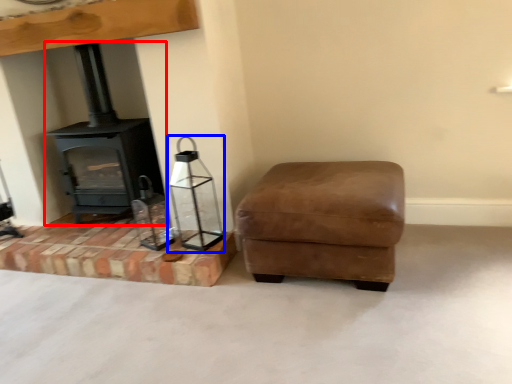
Question: Among these objects, which one is nearest to the camera, wood burning stove (highlighted by a red box) or candle holder (highlighted by a blue box)?

Choices:
 (A) wood burning stove
 (B) candle holder

Answer: (B)